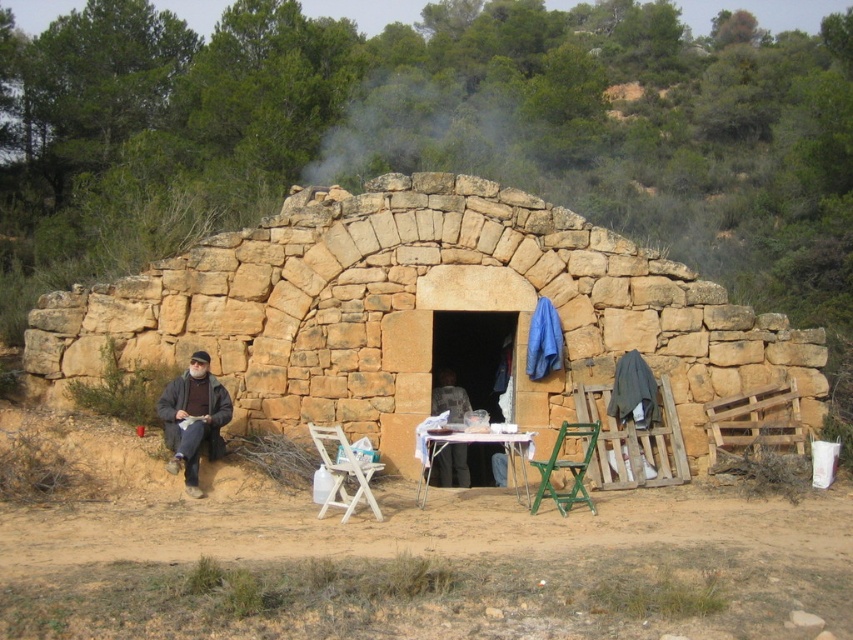
Which is above, dark gray woolen sweater at left or white wood folding chair at lower center?

dark gray woolen sweater at left

The image size is (853, 640). Describe the element at coordinates (193, 419) in the screenshot. I see `dark gray woolen sweater at left` at that location.

Identify the location of dark gray woolen sweater at left. (193, 419).

The image size is (853, 640). I want to click on dark gray woolen sweater at left, so click(193, 419).

Can you confirm if dark gray woolen sweater at left is bigger than green plastic chair at lower center?

No.

Can you confirm if dark gray woolen sweater at left is thinner than green plastic chair at lower center?

Yes.

Between point (181, 390) and point (577, 493), which one is positioned behind?

The point (181, 390) is behind.

Locate an element on the screen. The height and width of the screenshot is (640, 853). dark gray woolen sweater at left is located at coordinates (193, 419).

Who is positioned more to the right, natural stone hut at center or dark gray woolen sweater at left?

Positioned to the right is natural stone hut at center.

Who is more distant from viewer, (427, 262) or (167, 428)?

Point (427, 262)

Who is more distant from viewer, (x=273, y=304) or (x=189, y=472)?

The point (x=273, y=304) is behind.

Find the location of a particular element. This screenshot has height=640, width=853. natural stone hut at center is located at coordinates (418, 312).